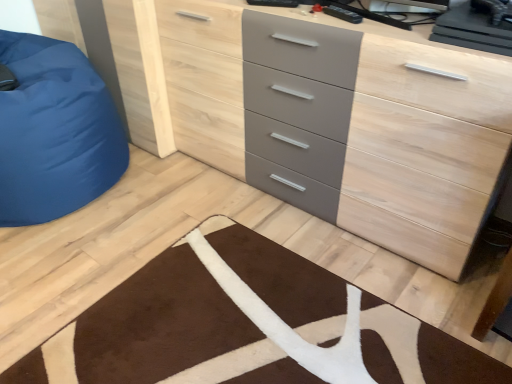
Question: Does matte gray chest of drawers at center lie behind brown plush rug at lower center?

Choices:
 (A) no
 (B) yes

Answer: (B)

Question: Is brown plush rug at lower center a part of matte gray chest of drawers at center?

Choices:
 (A) yes
 (B) no

Answer: (B)

Question: Is matte gray chest of drawers at center positioned far away from brown plush rug at lower center?

Choices:
 (A) no
 (B) yes

Answer: (A)

Question: From the image's perspective, is matte gray chest of drawers at center located beneath brown plush rug at lower center?

Choices:
 (A) no
 (B) yes

Answer: (A)

Question: Is matte gray chest of drawers at center smaller than brown plush rug at lower center?

Choices:
 (A) yes
 (B) no

Answer: (B)

Question: Is matte gray chest of drawers at center wider or thinner than blue fabric bean bag at left?

Choices:
 (A) thin
 (B) wide

Answer: (A)

Question: Considering the positions of matte gray chest of drawers at center and blue fabric bean bag at left in the image, is matte gray chest of drawers at center taller or shorter than blue fabric bean bag at left?

Choices:
 (A) tall
 (B) short

Answer: (A)

Question: From a real-world perspective, is matte gray chest of drawers at center physically located above or below blue fabric bean bag at left?

Choices:
 (A) above
 (B) below

Answer: (A)

Question: From the image's perspective, is matte gray chest of drawers at center positioned above or below blue fabric bean bag at left?

Choices:
 (A) below
 (B) above

Answer: (A)

Question: Is matte gray chest of drawers at center taller or shorter than brown plush rug at lower center?

Choices:
 (A) short
 (B) tall

Answer: (B)

Question: In terms of size, does matte gray chest of drawers at center appear bigger or smaller than brown plush rug at lower center?

Choices:
 (A) big
 (B) small

Answer: (A)

Question: Is matte gray chest of drawers at center to the left or to the right of brown plush rug at lower center in the image?

Choices:
 (A) left
 (B) right

Answer: (B)

Question: Is matte gray chest of drawers at center in front of or behind brown plush rug at lower center in the image?

Choices:
 (A) front
 (B) behind

Answer: (B)

Question: Is point (259, 344) positioned closer to the camera than point (212, 127)?

Choices:
 (A) farther
 (B) closer

Answer: (B)

Question: From their relative heights in the image, would you say brown plush rug at lower center is taller or shorter than matte gray chest of drawers at center?

Choices:
 (A) tall
 (B) short

Answer: (B)